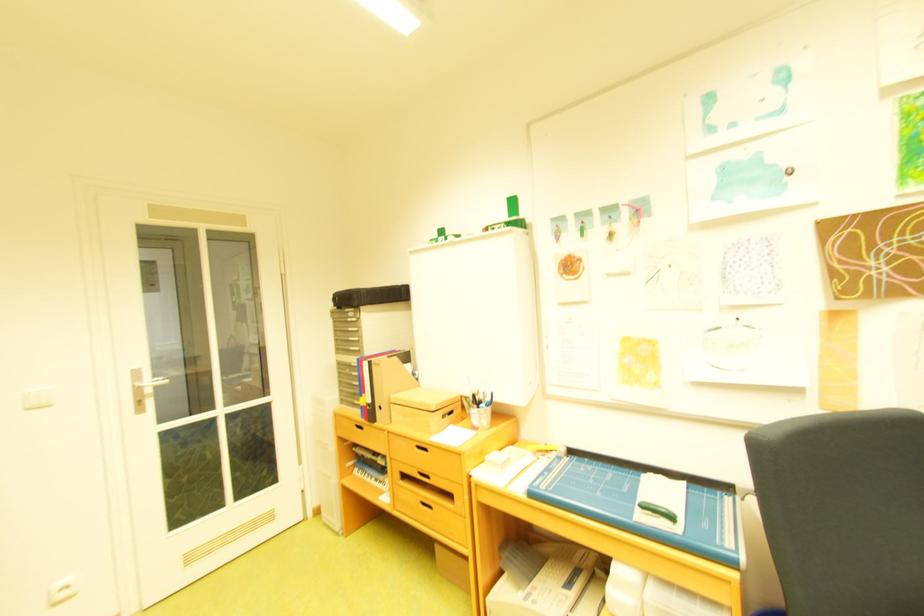
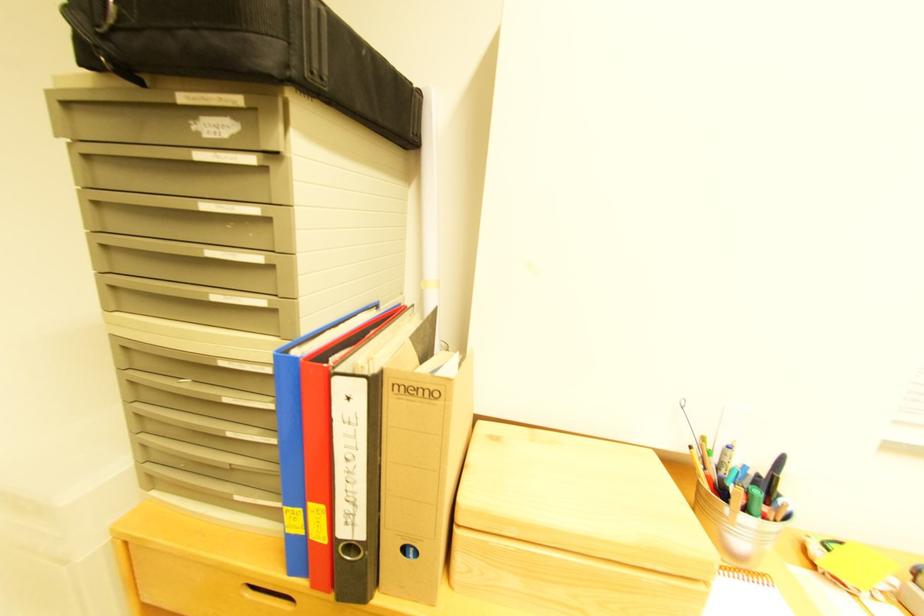
Where in the second image is the point corresponding to [373,294] from the first image?

(330, 10)